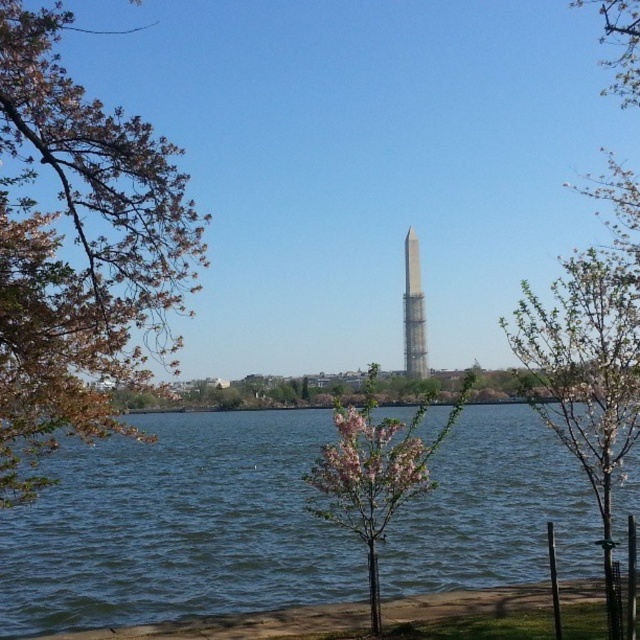
You are a tourist standing at the Tidal Basin and see the pink blossoming tree at center and the silver metallic tower at center. Which object is positioned to the left when facing the Washington Monument?

The pink blossoming tree at center is positioned to the left of the silver metallic tower at center when facing the Washington Monument.

You are a photographer planning to capture a wide shot of the Washington Monument and its surroundings. You notice the pink blossoming tree at center and the silver metallic tower at center in your frame. Based on their widths, which object might block the view of the other if positioned closer to the camera?

The pink blossoming tree at center might be wider than the silver metallic tower at center, so if positioned closer to the camera, it could potentially block the view of the silver metallic tower at center due to its greater width.

You are a photographer planning to capture the Washington Monument and the cherry blossoms in a single shot. Given that the pink blossoming tree at center is taller than the silver metallic tower at center, which object should you position closer to the front of the frame to ensure both are fully visible?

To ensure both the pink blossoming tree at center and the silver metallic tower at center are fully visible in the photo, position the shorter silver metallic tower at center closer to the front of the frame since it is shorter than the pink blossoming tree at center.